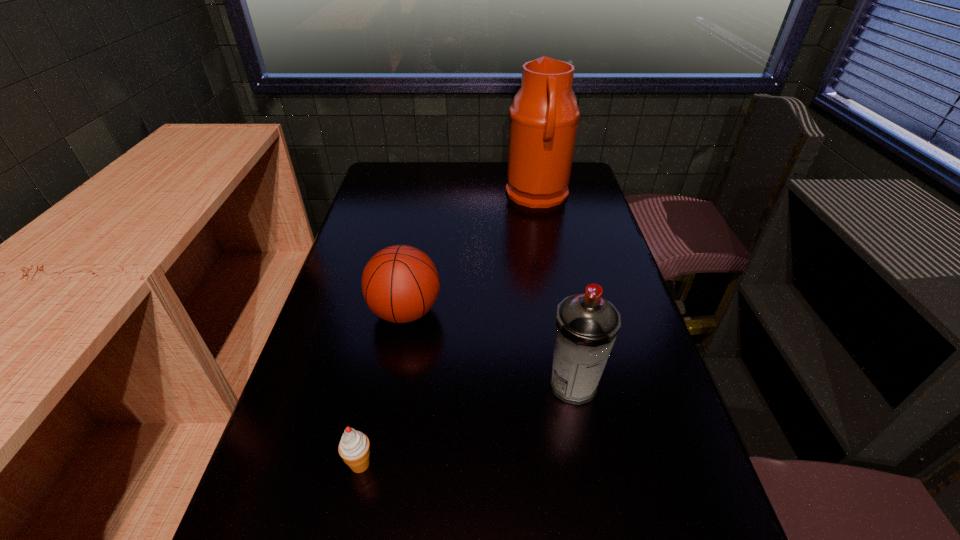
The height and width of the screenshot is (540, 960). I want to click on unoccupied area between the icecream and the aerosol can, so click(x=467, y=424).

At what (x,y) coordinates should I click in order to perform the action: click on vacant space that is in between the third tallest object and the third shortest object. Please return your answer as a coordinate pair (x, y). Looking at the image, I should click on (490, 348).

Select which object is the second closest to the icecream. Please provide its 2D coordinates. Your answer should be formatted as a tuple, i.e. [(x, y)], where the tuple contains the x and y coordinates of a point satisfying the conditions above.

[(587, 325)]

Find the location of a particular element. The image size is (960, 540). object that is the second closest to the aerosol can is located at coordinates (354, 448).

Where is `free spot that satisfies the following two spatial constraints: 1. from the spout of the water jug; 2. on the front side of the third nearest object`? Image resolution: width=960 pixels, height=540 pixels. free spot that satisfies the following two spatial constraints: 1. from the spout of the water jug; 2. on the front side of the third nearest object is located at coordinates (560, 312).

Locate an element on the screen. The height and width of the screenshot is (540, 960). vacant point that satisfies the following two spatial constraints: 1. on the back side of the shortest object; 2. on the right side of the second shortest object is located at coordinates (393, 312).

The width and height of the screenshot is (960, 540). Identify the location of vacant area that satisfies the following two spatial constraints: 1. on the back side of the icecream; 2. on the left side of the second shortest object. (393, 312).